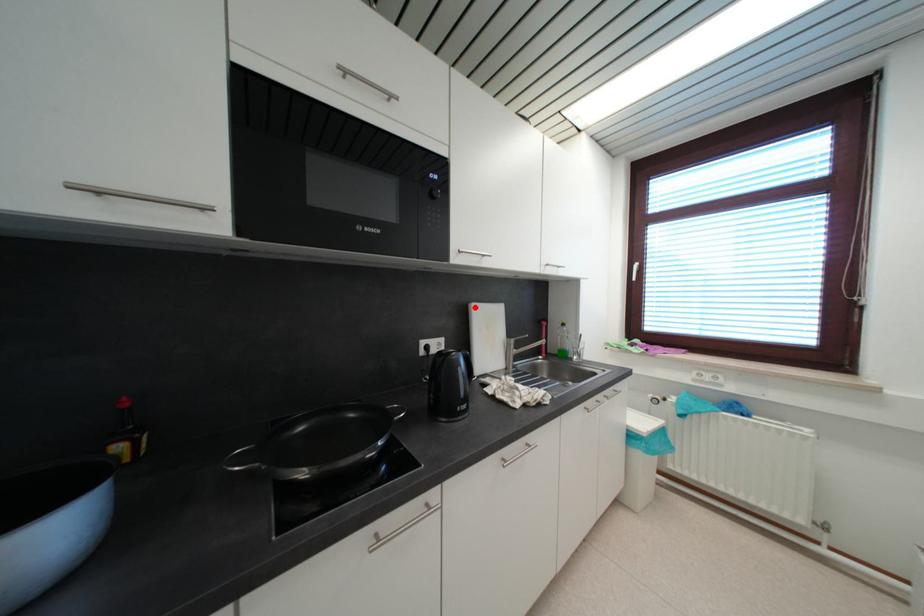
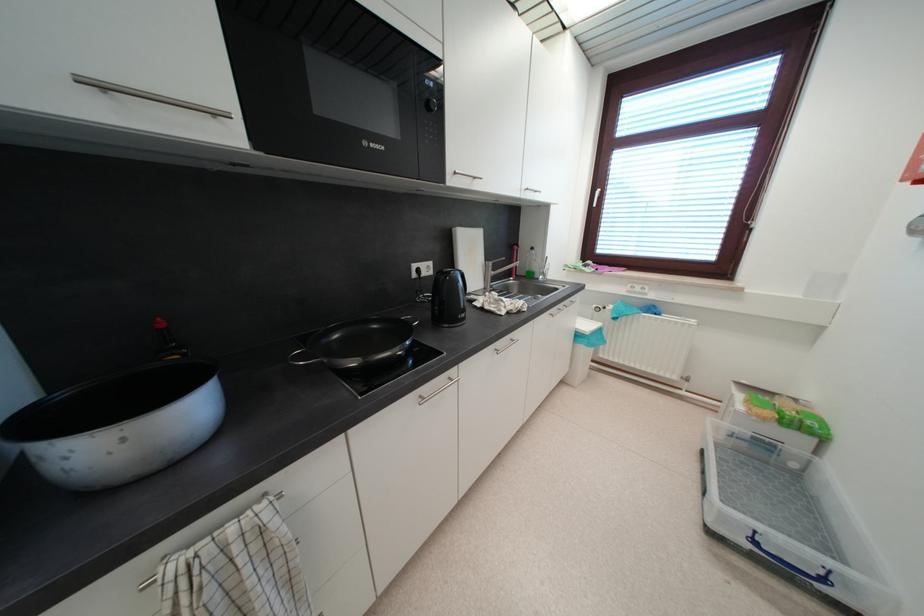
Question: A red point is marked in image1. In image2, is the corresponding 3D point closer to the camera or farther? Reply with the corresponding letter.

Choices:
 (A) The corresponding 3D point is closer.
 (B) The corresponding 3D point is farther.

Answer: (A)